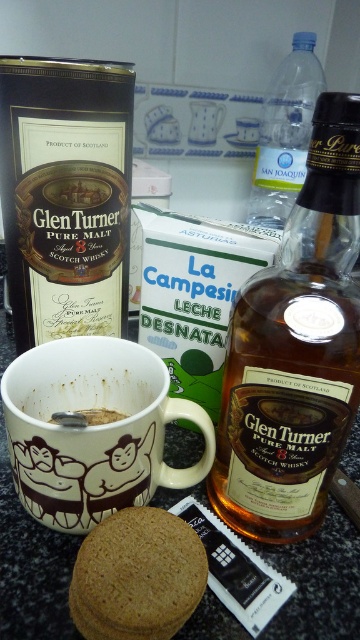
Is point (213, 496) positioned behind point (88, 362)?

No, (213, 496) is closer to viewer.

Can you confirm if amber glass bottle at center is positioned above white matte mug at center?

Yes.

Image resolution: width=360 pixels, height=640 pixels. I want to click on amber glass bottle at center, so click(x=295, y=349).

Who is more distant from viewer, [306,209] or [115,412]?

Positioned behind is point [115,412].

Is point (250, 468) more distant than point (97, 412)?

No, it is in front of (97, 412).

Image resolution: width=360 pixels, height=640 pixels. I want to click on amber glass bottle at center, so click(x=295, y=349).

Is matte black bottle at center smaller than white matte mug at center?

Incorrect, matte black bottle at center is not smaller in size than white matte mug at center.

Is matte black bottle at center bigger than white matte mug at center?

Yes.

The width and height of the screenshot is (360, 640). What do you see at coordinates (65, 195) in the screenshot?
I see `matte black bottle at center` at bounding box center [65, 195].

The image size is (360, 640). I want to click on matte black bottle at center, so click(65, 195).